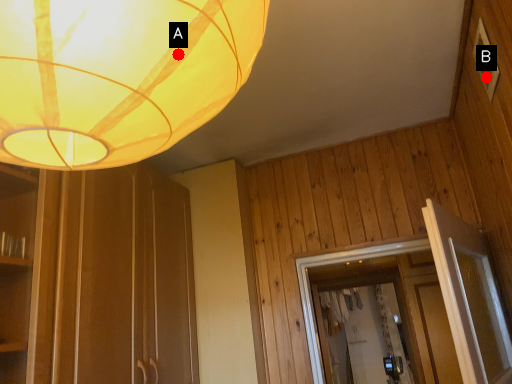
Question: Two points are circled on the image, labeled by A and B beside each circle. Which point is farther from the camera taking this photo?

Choices:
 (A) A is further
 (B) B is further

Answer: (B)